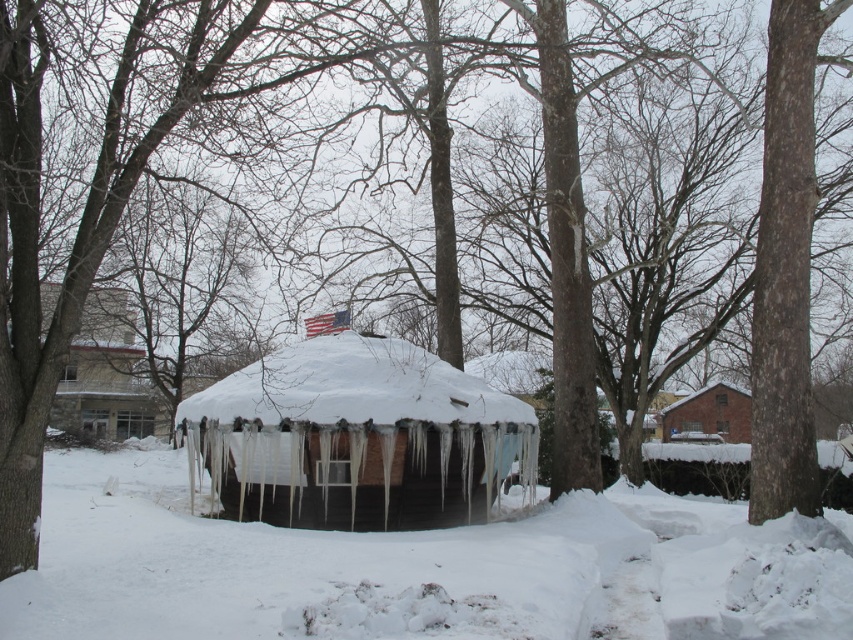
Is white frosty snow at center above brick house at right?

No.

Does white frosty snow at center have a greater height compared to brick house at right?

Incorrect, white frosty snow at center's height is not larger of brick house at right's.

Who is more distant from viewer, (349, 616) or (730, 404)?

The point (730, 404) is behind.

The height and width of the screenshot is (640, 853). In order to click on white frosty snow at center in this screenshot , I will do `click(418, 570)`.

Does point (743, 580) lie in front of point (248, 472)?

Yes, point (743, 580) is closer to viewer.

Who is lower down, white frosty snow at center or white wooden hut at center?

white frosty snow at center is below.

Does point (223, 624) lie behind point (247, 483)?

No, it is in front of (247, 483).

Locate an element on the screen. white frosty snow at center is located at coordinates (418, 570).

Does white wooden hut at center have a smaller size compared to brick house at right?

Yes, white wooden hut at center is smaller than brick house at right.

From the picture: Does white wooden hut at center have a lesser width compared to brick house at right?

Correct, white wooden hut at center's width is less than brick house at right's.

This screenshot has width=853, height=640. I want to click on white wooden hut at center, so pos(357,436).